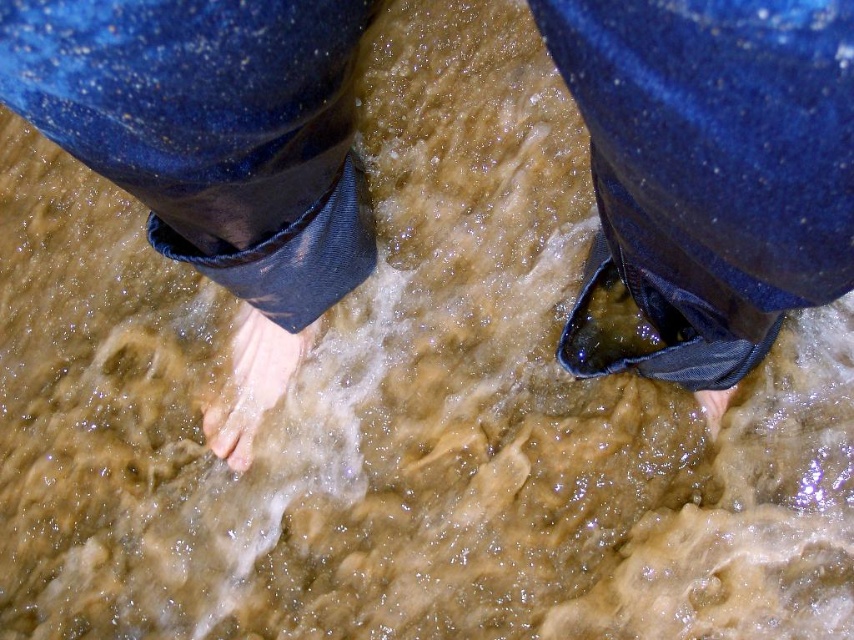
Question: Is denim at lower right thinner than pale skin/soft flesh at lower center?

Choices:
 (A) no
 (B) yes

Answer: (A)

Question: Does denim at lower left have a greater width compared to matte skin toe at lower center?

Choices:
 (A) no
 (B) yes

Answer: (B)

Question: Which point is closer to the camera?

Choices:
 (A) denim at lower right
 (B) pale skin/soft flesh at lower center

Answer: (A)

Question: Which of the following is the closest to the observer?

Choices:
 (A) denim at lower right
 (B) matte skin toe at lower center
 (C) denim at lower left

Answer: (A)

Question: Among these objects, which one is nearest to the camera?

Choices:
 (A) denim at lower left
 (B) denim at lower right
 (C) matte skin toe at lower center
 (D) pale skin/soft flesh at lower center

Answer: (B)

Question: Considering the relative positions of denim at lower left and pale skin/soft flesh at lower center in the image provided, where is denim at lower left located with respect to pale skin/soft flesh at lower center?

Choices:
 (A) right
 (B) left

Answer: (A)